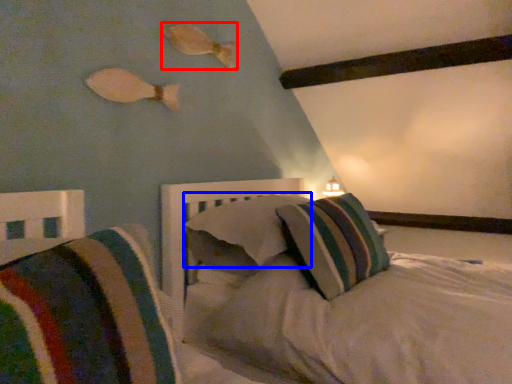
Question: Which of the following is the closest to the observer, fish (highlighted by a red box) or pillow (highlighted by a blue box)?

Choices:
 (A) fish
 (B) pillow

Answer: (B)